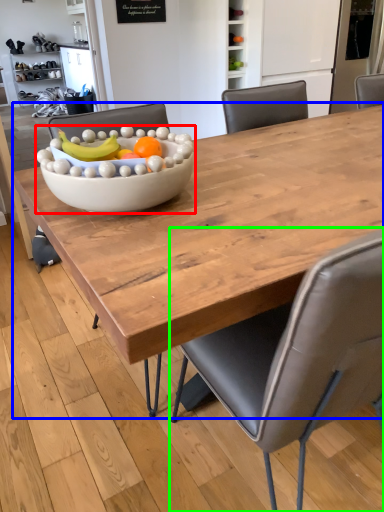
Question: Considering the real-world distances, which object is farthest from bowl (highlighted by a red box)? coffee table (highlighted by a blue box) or chair (highlighted by a green box)?

Choices:
 (A) coffee table
 (B) chair

Answer: (B)